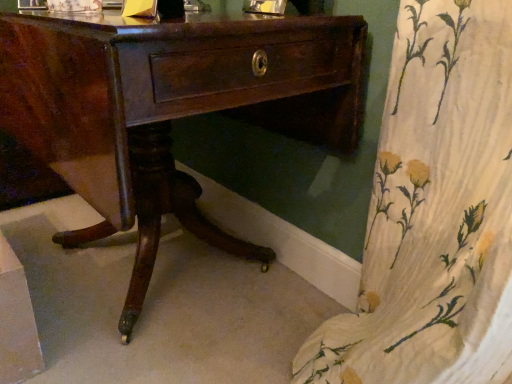
What do you see at coordinates (169, 109) in the screenshot? I see `shiny dark wood desk at center` at bounding box center [169, 109].

What is the approximate width of shiny dark wood desk at center?

shiny dark wood desk at center is 24.07 inches in width.

Measure the distance between point [1,99] and camera.

The depth of point [1,99] is 3.67 feet.

What is the approximate height of shiny dark wood desk at center?

75.50 centimeters.

Where is `shiny dark wood desk at center`? The image size is (512, 384). shiny dark wood desk at center is located at coordinates (169, 109).

Identify the location of shiny dark wood desk at center. This screenshot has height=384, width=512. (169, 109).